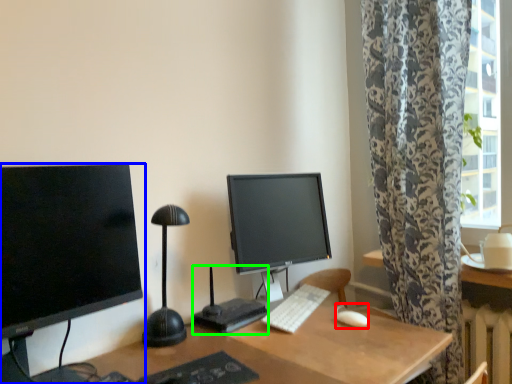
Question: Estimate the real-world distances between objects in this image. Which object is closer to mouse (highlighted by a red box), computer monitor (highlighted by a blue box) or computer desk (highlighted by a green box)?

Choices:
 (A) computer monitor
 (B) computer desk

Answer: (B)